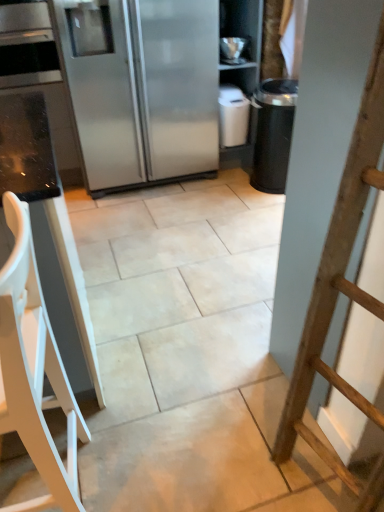
Question: Can you confirm if satin silver refrigerator at upper left is taller than white plastic chair at left?

Choices:
 (A) yes
 (B) no

Answer: (A)

Question: From the image's perspective, is satin silver refrigerator at upper left under white plastic chair at left?

Choices:
 (A) yes
 (B) no

Answer: (B)

Question: Would you say satin silver refrigerator at upper left contains white plastic chair at left?

Choices:
 (A) no
 (B) yes

Answer: (A)

Question: Does satin silver refrigerator at upper left have a smaller size compared to white plastic chair at left?

Choices:
 (A) yes
 (B) no

Answer: (B)

Question: Is satin silver refrigerator at upper left not within white plastic chair at left?

Choices:
 (A) no
 (B) yes

Answer: (B)

Question: Can you confirm if satin silver refrigerator at upper left is thinner than white plastic chair at left?

Choices:
 (A) yes
 (B) no

Answer: (B)

Question: From the image's perspective, is white plastic chair at left on top of satin silver refrigerator at upper left?

Choices:
 (A) no
 (B) yes

Answer: (A)

Question: Does white plastic chair at left have a lesser height compared to satin silver refrigerator at upper left?

Choices:
 (A) no
 (B) yes

Answer: (B)

Question: Does white plastic chair at left lie behind satin silver refrigerator at upper left?

Choices:
 (A) yes
 (B) no

Answer: (B)

Question: Considering the relative sizes of white plastic chair at left and satin silver refrigerator at upper left in the image provided, is white plastic chair at left thinner than satin silver refrigerator at upper left?

Choices:
 (A) no
 (B) yes

Answer: (B)

Question: From a real-world perspective, is white plastic chair at left physically above satin silver refrigerator at upper left?

Choices:
 (A) no
 (B) yes

Answer: (A)

Question: Can you confirm if white plastic chair at left is positioned to the right of satin silver refrigerator at upper left?

Choices:
 (A) yes
 (B) no

Answer: (B)

Question: From the image's perspective, is white plastic chair at left located above or below satin silver refrigerator at upper left?

Choices:
 (A) above
 (B) below

Answer: (B)